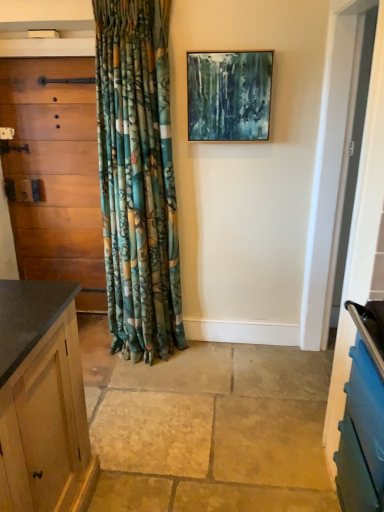
Identify the location of free point above wooden cabinet at left (from a real-world perspective). Image resolution: width=384 pixels, height=512 pixels. (46, 59).